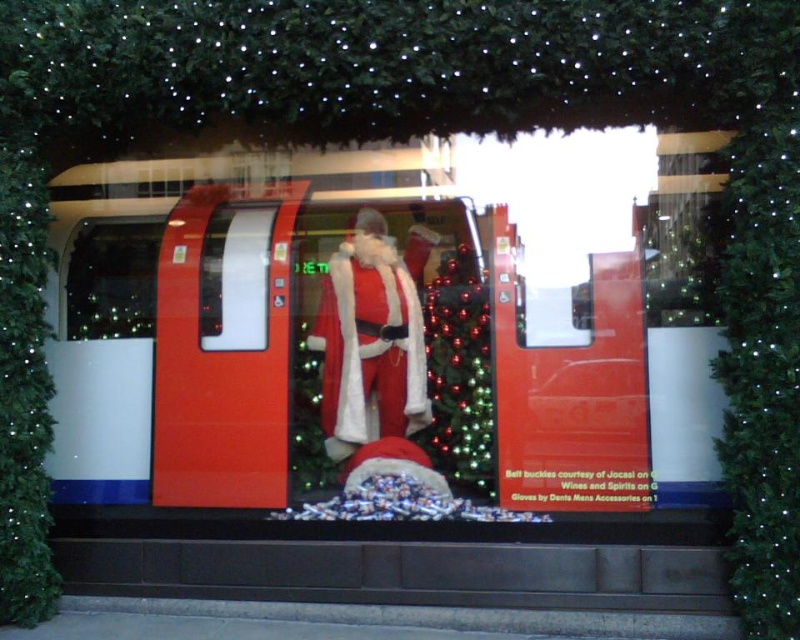
You are a toy designer who wants to create a miniature version of the festive display. You need to ensure the shiny red train at center and the green matte lights at left are scaled proportionally. Which object should be made larger in the miniature to maintain the correct size relationship?

The shiny red train at center should be made larger than the green matte lights at left in the miniature to maintain the correct size relationship, as it is bigger in the original display.